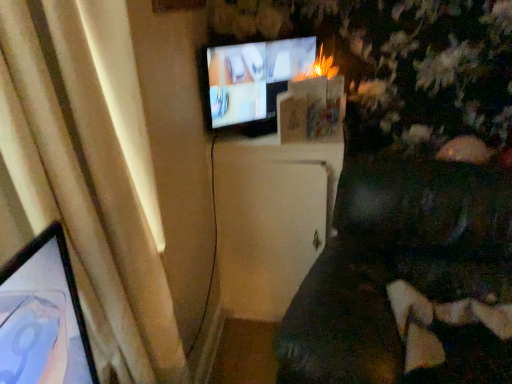
Question: From the image's perspective, is dark brown fabric couch at lower right located above or below matte black tv at upper center?

Choices:
 (A) above
 (B) below

Answer: (B)

Question: Would you say dark brown fabric couch at lower right is to the left or to the right of matte black tv at upper center in the picture?

Choices:
 (A) left
 (B) right

Answer: (B)

Question: Considering the real-world distances, which object is closest to the beige fabric curtain at left?

Choices:
 (A) matte black tv at upper center
 (B) white matte cabinet at center
 (C) dark brown fabric couch at lower right

Answer: (B)

Question: Which object is the closest to the white matte cabinet at center?

Choices:
 (A) dark brown fabric couch at lower right
 (B) beige fabric curtain at left
 (C) matte black tv at upper center

Answer: (C)